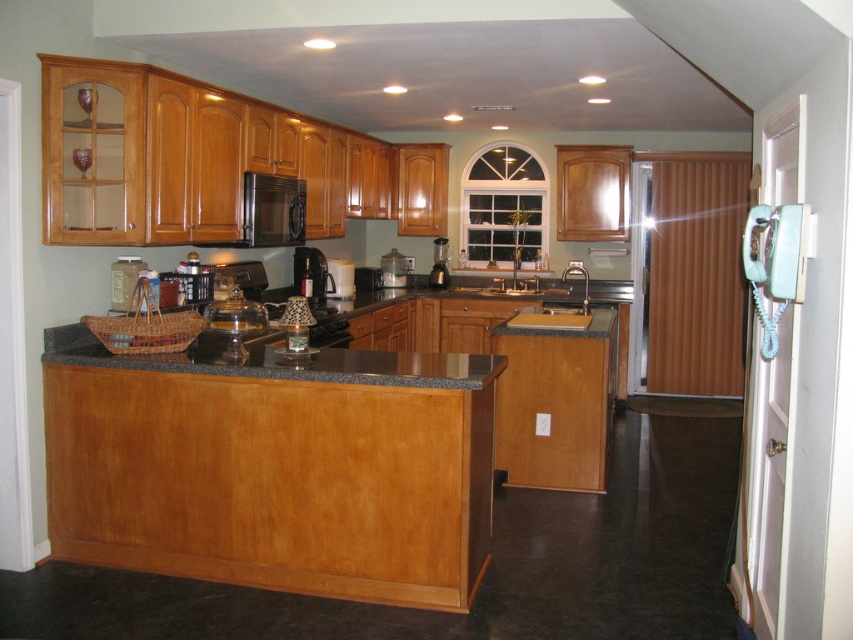
You are standing in the kitchen and want to reach both the point at coordinates point (323, 292) and the point at coordinates point (331, 262). Which point will you reach first?

You will reach point (323, 292) first because it is closer to you than point (331, 262).

You are a kitchen designer planning to place a new appliance between the satin black microwave at upper center and the clear glass blender at center. The new appliance requires a space wider than the microwave. Is there enough space between them for this appliance?

The satin black microwave at upper center is wider than the clear glass blender at center. However, the question states that the new appliance needs a space wider than the microwave. Since the microwave itself is already wider than the blender, the space between them may not be sufficient unless the distance between the two objects is greater than the microwave width. Without specific distance information, it is unclear if there is enough space.

You are trying to place a new toaster that is 12 inches wide on the counter between the black plastic coffee machine at center and the white plastic blender at center. Can you fit it there?

The black plastic coffee machine at center might be wider than the white plastic blender at center, so there might not be enough space to fit the 12 inch wide toaster between them. Measure the space first before placing the toaster.